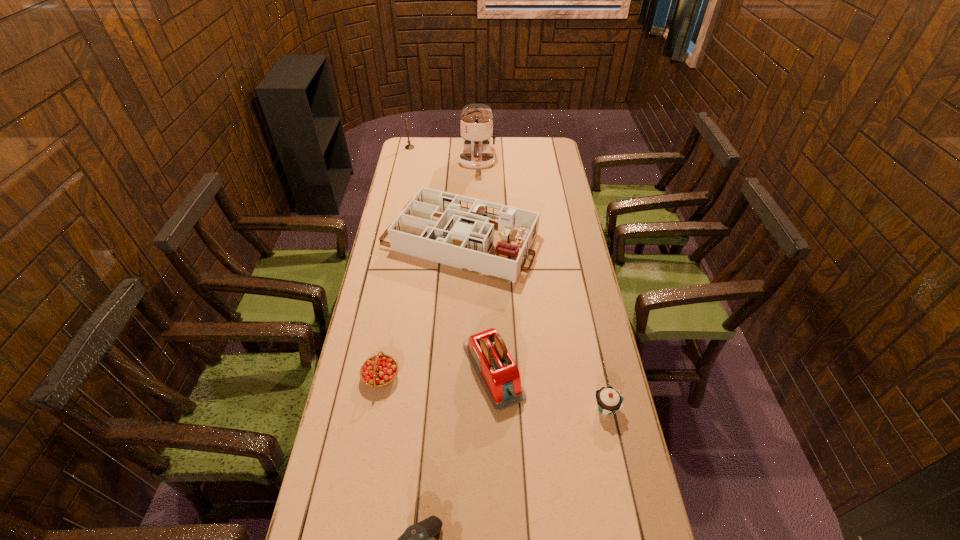
Locate an element on the screen. This screenshot has width=960, height=540. vacant space that's between the toaster and the dollhouse is located at coordinates (476, 306).

Locate an element on the screen. Image resolution: width=960 pixels, height=540 pixels. free spot between the strawberry and the coffee maker is located at coordinates (429, 269).

Find the location of a particular element. This screenshot has width=960, height=540. vacant area between the tallest object and the strawberry is located at coordinates (429, 269).

Identify which object is located as the fourth nearest to the candle. Please provide its 2D coordinates. Your answer should be formatted as a tuple, i.e. [(x, y)], where the tuple contains the x and y coordinates of a point satisfying the conditions above.

[(378, 371)]

Locate an element on the screen. This screenshot has height=540, width=960. the fourth closest object relative to the strawberry is located at coordinates (608, 400).

At what (x,y) coordinates should I click in order to perform the action: click on free spot that satisfies the following two spatial constraints: 1. on the front-facing side of the toaster; 2. on the left side of the coffee maker. Please return your answer as a coordinate pair (x, y). Looking at the image, I should click on (475, 371).

The height and width of the screenshot is (540, 960). Identify the location of vacant space that satisfies the following two spatial constraints: 1. on the front-facing side of the toaster; 2. on the left side of the tallest object. (475, 371).

Where is `vacant area in the image that satisfies the following two spatial constraints: 1. on the front-facing side of the toaster; 2. on the right side of the tallest object`? vacant area in the image that satisfies the following two spatial constraints: 1. on the front-facing side of the toaster; 2. on the right side of the tallest object is located at coordinates (475, 371).

The height and width of the screenshot is (540, 960). What are the coordinates of `free space in the image that satisfies the following two spatial constraints: 1. on the front side of the toaster; 2. on the left side of the candle` in the screenshot? It's located at (362, 371).